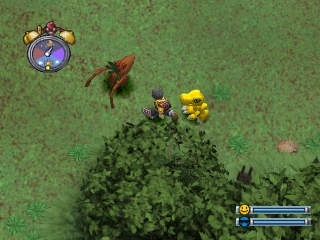
Image resolution: width=320 pixels, height=240 pixels. I want to click on clock hand, so 48,54.